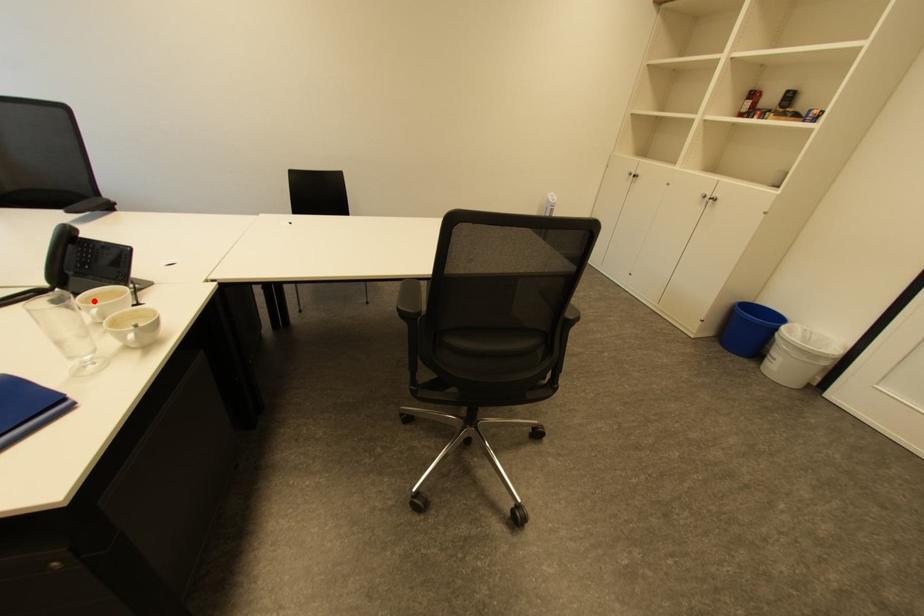
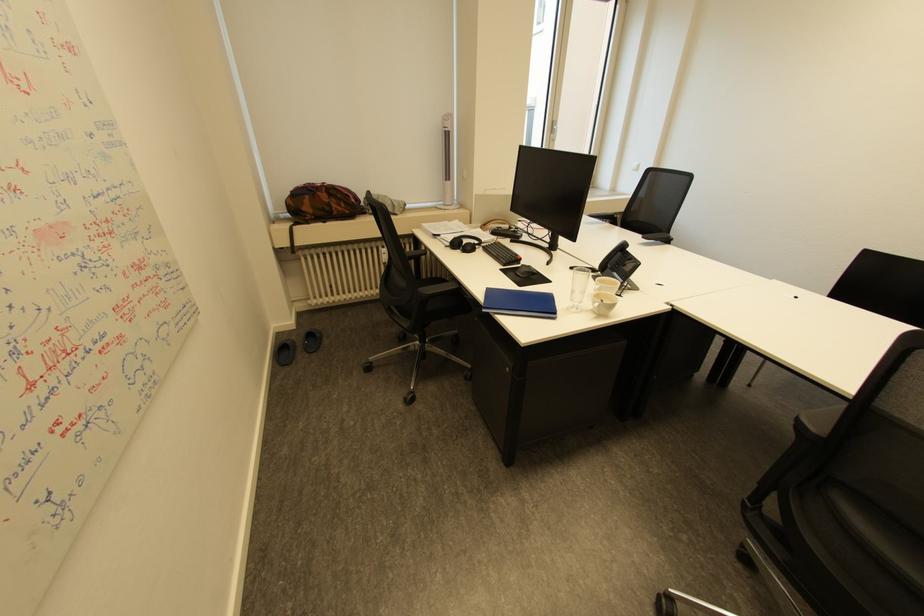
Find the pixel in the second image that matches the highlighted location in the first image.

(608, 281)